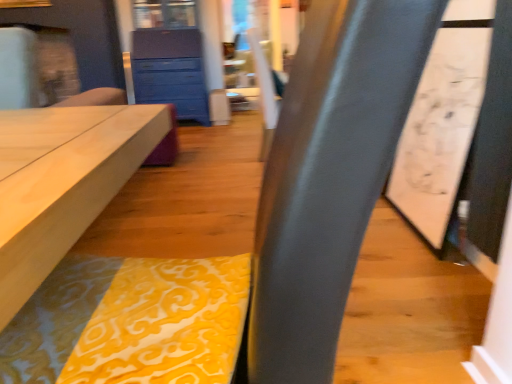
The image size is (512, 384). What do you see at coordinates (130, 322) in the screenshot?
I see `yellow damask fabric at center` at bounding box center [130, 322].

Find the location of `yellow damask fabric at center`. yellow damask fabric at center is located at coordinates (130, 322).

Find the location of a particular element. Image resolution: width=512 pixels, height=384 pixels. blue painted wood chest of drawers at upper center is located at coordinates (170, 71).

Describe the element at coordinates (170, 71) in the screenshot. I see `blue painted wood chest of drawers at upper center` at that location.

I want to click on yellow damask fabric at center, so click(x=130, y=322).

Does blue painted wood chest of drawers at upper center appear on the right side of yellow damask fabric at center?

Incorrect, blue painted wood chest of drawers at upper center is not on the right side of yellow damask fabric at center.

Which object is closer to the camera, blue painted wood chest of drawers at upper center or yellow damask fabric at center?

yellow damask fabric at center is more forward.

Which is more distant, (186,46) or (143,383)?

The point (186,46) is farther from the camera.

From the image's perspective, is blue painted wood chest of drawers at upper center located above or below yellow damask fabric at center?

From the image's perspective, blue painted wood chest of drawers at upper center appears above yellow damask fabric at center.

From a real-world perspective, between blue painted wood chest of drawers at upper center and yellow damask fabric at center, who is vertically lower?

From a 3D spatial view, yellow damask fabric at center is below.

Which object is thinner, blue painted wood chest of drawers at upper center or yellow damask fabric at center?

With smaller width is yellow damask fabric at center.

In terms of height, does blue painted wood chest of drawers at upper center look taller or shorter compared to yellow damask fabric at center?

In the image, blue painted wood chest of drawers at upper center appears to be taller than yellow damask fabric at center.

Can you confirm if blue painted wood chest of drawers at upper center is bigger than yellow damask fabric at center?

Yes, blue painted wood chest of drawers at upper center is bigger than yellow damask fabric at center.

Is blue painted wood chest of drawers at upper center not within yellow damask fabric at center?

Yes, blue painted wood chest of drawers at upper center is outside of yellow damask fabric at center.

Looking at this image, are blue painted wood chest of drawers at upper center and yellow damask fabric at center located far from each other?

Yes, blue painted wood chest of drawers at upper center is far from yellow damask fabric at center.

Is blue painted wood chest of drawers at upper center facing away from yellow damask fabric at center?

No.

Can you tell me how much blue painted wood chest of drawers at upper center and yellow damask fabric at center differ in facing direction?

The facing directions of blue painted wood chest of drawers at upper center and yellow damask fabric at center are 98.3 degrees apart.

Identify the location of chest of drawers on the left of yellow damask fabric at center. This screenshot has width=512, height=384. (170, 71).

Is yellow damask fabric at center to the right of blue painted wood chest of drawers at upper center from the viewer's perspective?

Indeed, yellow damask fabric at center is positioned on the right side of blue painted wood chest of drawers at upper center.

Looking at this image, is yellow damask fabric at center behind blue painted wood chest of drawers at upper center?

No, it is not.

Which is in front, point (84, 265) or point (146, 53)?

Point (84, 265)

From the image's perspective, would you say yellow damask fabric at center is positioned over blue painted wood chest of drawers at upper center?

No, from the image's perspective, yellow damask fabric at center is not above blue painted wood chest of drawers at upper center.

From a real-world perspective, which is physically below, yellow damask fabric at center or blue painted wood chest of drawers at upper center?

From a 3D spatial view, yellow damask fabric at center is below.

Between yellow damask fabric at center and blue painted wood chest of drawers at upper center, which one has smaller width?

Thinner between the two is yellow damask fabric at center.

Can you confirm if yellow damask fabric at center is shorter than blue painted wood chest of drawers at upper center?

Indeed, yellow damask fabric at center has a lesser height compared to blue painted wood chest of drawers at upper center.

Based on the photo, considering the relative sizes of yellow damask fabric at center and blue painted wood chest of drawers at upper center in the image provided, is yellow damask fabric at center smaller than blue painted wood chest of drawers at upper center?

Yes.

Do you think yellow damask fabric at center is within blue painted wood chest of drawers at upper center, or outside of it?

yellow damask fabric at center cannot be found inside blue painted wood chest of drawers at upper center.

Is yellow damask fabric at center with blue painted wood chest of drawers at upper center?

No, yellow damask fabric at center is not making contact with blue painted wood chest of drawers at upper center.

Is blue painted wood chest of drawers at upper center at the back of yellow damask fabric at center?

yellow damask fabric at center does not have its back to blue painted wood chest of drawers at upper center.

What's the angular difference between yellow damask fabric at center and blue painted wood chest of drawers at upper center's facing directions?

98.3 degrees separate the facing orientations of yellow damask fabric at center and blue painted wood chest of drawers at upper center.

Locate an element on the screen. Image resolution: width=512 pixels, height=384 pixels. chest of drawers behind the yellow damask fabric at center is located at coordinates (170, 71).

You are a GUI agent. You are given a task and a screenshot of the screen. Output one action in this format:
    pyautogui.click(x=<x>, y=<y>)
    Task: Click on the chest of drawers that is above the yellow damask fabric at center (from the image's perspective)
    This screenshot has width=512, height=384.
    Given the screenshot: What is the action you would take?
    pyautogui.click(x=170, y=71)

Locate an element on the screen. blanket located on the right of blue painted wood chest of drawers at upper center is located at coordinates (130, 322).